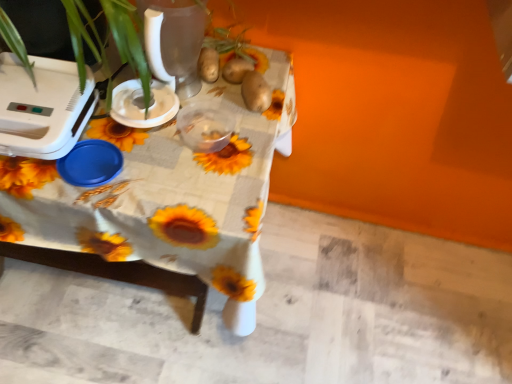
The width and height of the screenshot is (512, 384). Find the location of `unoccupied area behind brown matte potato at upper center`. unoccupied area behind brown matte potato at upper center is located at coordinates (249, 49).